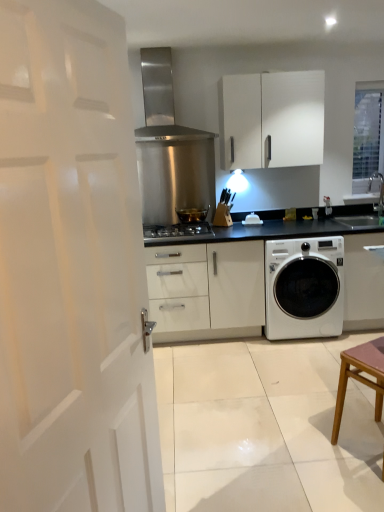
This screenshot has width=384, height=512. Find the location of `vacant region below brown wooden table at lower right (from a real-world perspective)`. vacant region below brown wooden table at lower right (from a real-world perspective) is located at coordinates (367, 446).